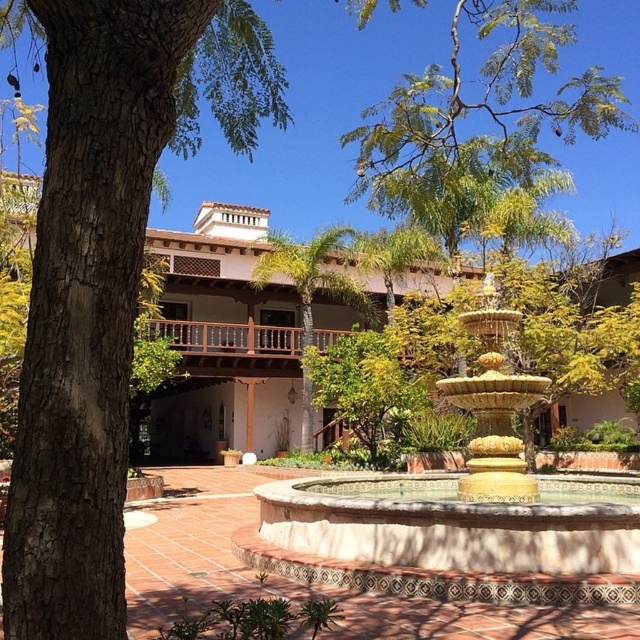
You are planning to place a new bench in the courtyard. The bench requires a space wider than the gold metallic fountain at center. Can the space occupied by the green leafy tree at center accommodate the bench?

The gold metallic fountain at center is wider than the green leafy tree at center. Since the bench requires a space wider than the gold metallic fountain at center, the space occupied by the green leafy tree at center is not wide enough to accommodate the bench.

You are standing in the courtyard and want to take a photo of the gold metallic fountain at center and the green leafy tree at center. Which object should you focus on first if you want to capture both in a single frame without moving the camera?

The gold metallic fountain at center is below the green leafy tree at center, so you should focus on the green leafy tree at center first to ensure both are in the frame.

You are standing in the courtyard and want to locate the gold metallic fountain at center. According to the coordinates provided, in which direction should you move relative to your current position at point 0,0?

The gold metallic fountain at center is located at point [460,513], which is northeast of your current position at point [0,0]. Move northeast to reach it.